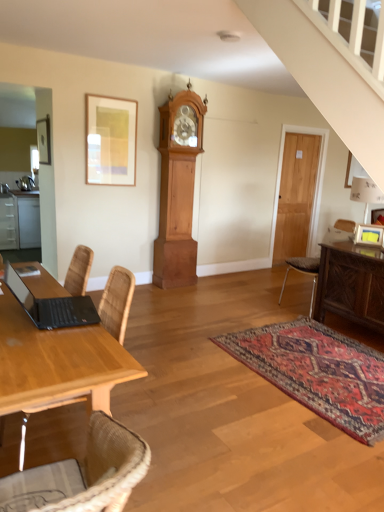
The height and width of the screenshot is (512, 384). Identify the location of free point above wooden table at left (from a real-world perspective). (42, 322).